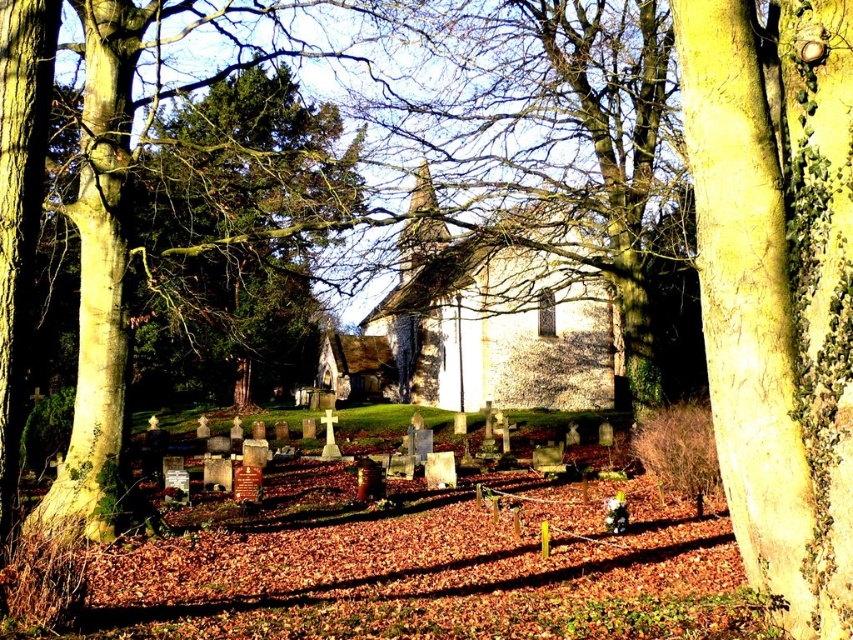
Question: Which point is farther from the camera taking this photo?

Choices:
 (A) (593, 211)
 (B) (693, 156)

Answer: (A)

Question: Where is green rough bark tree at right located in relation to smooth bark tree at center in the image?

Choices:
 (A) above
 (B) below

Answer: (B)

Question: Is green rough bark tree at right bigger than smooth bark tree at center?

Choices:
 (A) yes
 (B) no

Answer: (B)

Question: Is green rough bark tree at right behind smooth bark tree at center?

Choices:
 (A) yes
 (B) no

Answer: (B)

Question: Which point is farther from the camera taking this photo?

Choices:
 (A) (809, 77)
 (B) (624, 150)

Answer: (B)